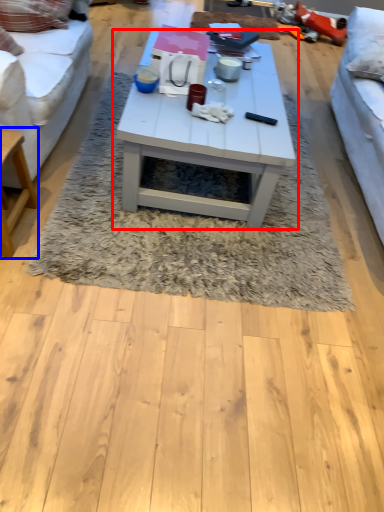
Question: Which point is closer to the camera, coffee table (highlighted by a red box) or table (highlighted by a blue box)?

Choices:
 (A) coffee table
 (B) table

Answer: (B)